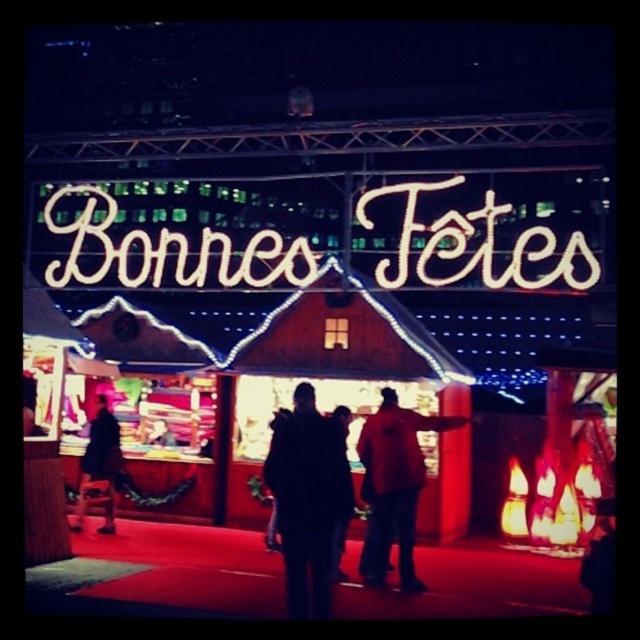
In the scene shown: You are organizing a holiday gift exchange and need to determine which jacket can fit into a standard gift box that requires the item to be under 12 inches in height. Given the dark fabric jacket at center and the red matte jacket at center, which one is more likely to exceed the height limit?

The dark fabric jacket at center has a greater height compared to the red matte jacket at center, so it is more likely to exceed the 12 inches height limit and cannot fit into the standard gift box.